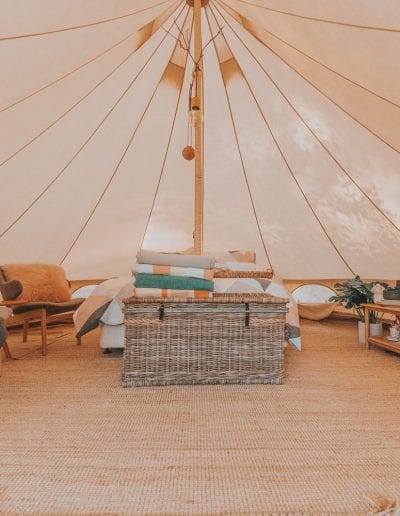
Identify the location of bare carpet. (201, 454).